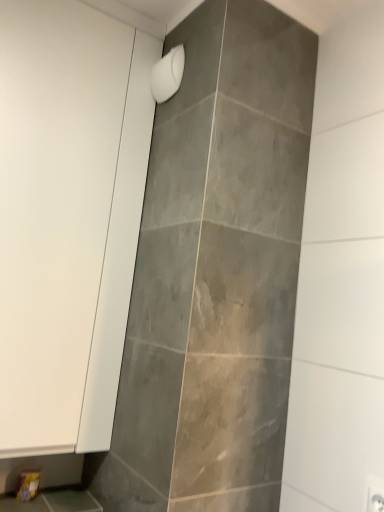
Question: Visually, is white matte shower head at upper center positioned to the left or to the right of white matte cabinet at left?

Choices:
 (A) right
 (B) left

Answer: (A)

Question: From their relative heights in the image, would you say white matte shower head at upper center is taller or shorter than white matte cabinet at left?

Choices:
 (A) short
 (B) tall

Answer: (A)

Question: In the image, is white matte shower head at upper center positioned in front of or behind white matte cabinet at left?

Choices:
 (A) front
 (B) behind

Answer: (B)

Question: From the image's perspective, is white matte cabinet at left above or below white matte shower head at upper center?

Choices:
 (A) above
 (B) below

Answer: (B)

Question: In terms of width, does white matte cabinet at left look wider or thinner when compared to white matte shower head at upper center?

Choices:
 (A) wide
 (B) thin

Answer: (A)

Question: Is point (51, 66) closer or farther from the camera than point (177, 68)?

Choices:
 (A) closer
 (B) farther

Answer: (A)

Question: Is white matte cabinet at left bigger or smaller than white matte shower head at upper center?

Choices:
 (A) big
 (B) small

Answer: (A)